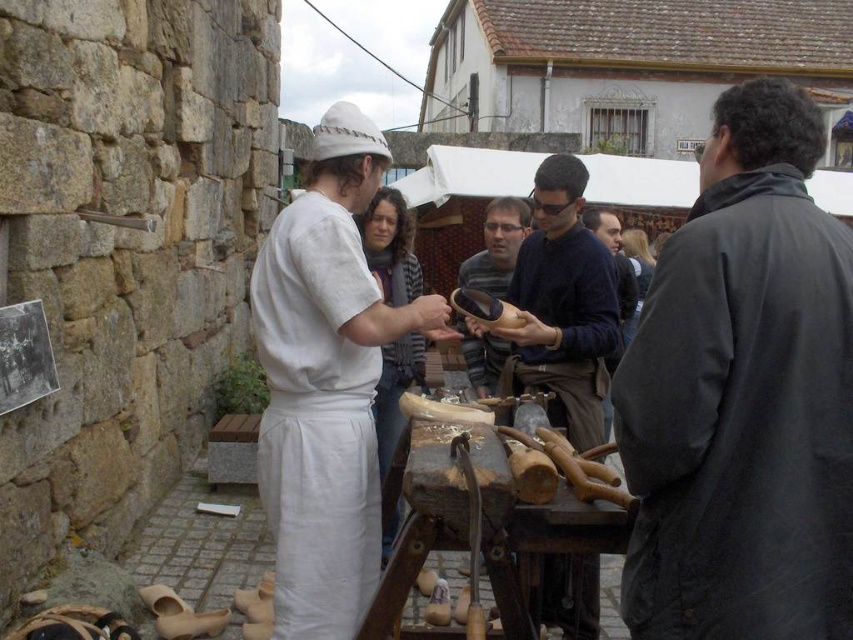
Question: Is dark blue sweater at center wider than wooden shoe at center?

Choices:
 (A) yes
 (B) no

Answer: (A)

Question: Which is nearer to the dark gray jacket at right?

Choices:
 (A) white cloth at center
 (B) white linen robe at center
 (C) wooden shoe at center
 (D) dark blue sweater at center

Answer: (B)

Question: Which object is positioned farthest from the white cloth at center?

Choices:
 (A) dark gray jacket at right
 (B) white linen robe at center
 (C) dark blue sweater at center

Answer: (A)

Question: Can you confirm if dark blue sweater at center is thinner than wooden shoe at center?

Choices:
 (A) no
 (B) yes

Answer: (A)

Question: Based on their relative distances, which object is farther from the dark blue sweater at center?

Choices:
 (A) white cloth at center
 (B) white linen robe at center
 (C) wooden shoe at center
 (D) dark gray jacket at right

Answer: (D)

Question: Does white linen robe at center have a larger size compared to dark blue sweater at center?

Choices:
 (A) yes
 (B) no

Answer: (B)